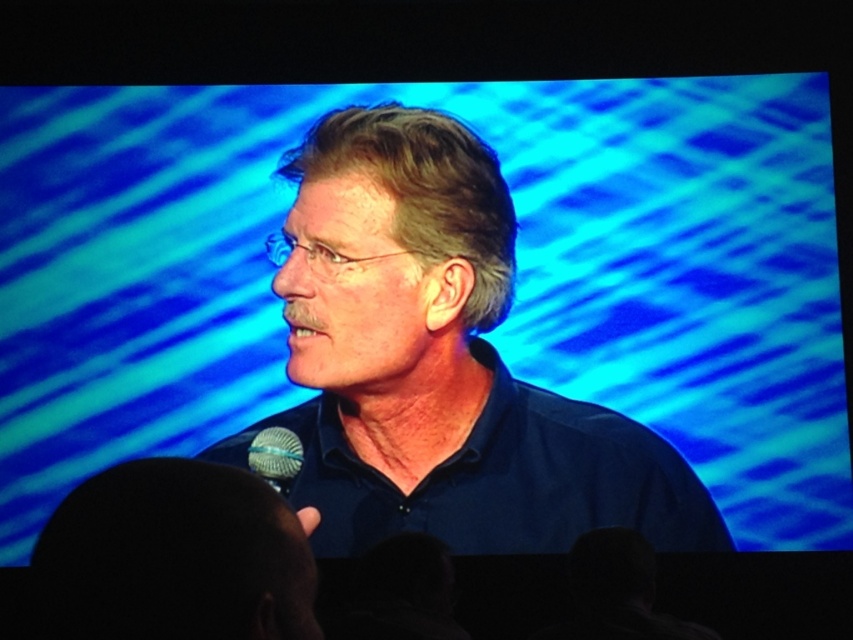
Is blue matte shirt at center smaller than satin silver microphone at lower center?

Actually, blue matte shirt at center might be larger than satin silver microphone at lower center.

Which of these two, blue matte shirt at center or satin silver microphone at lower center, stands shorter?

Standing shorter between the two is satin silver microphone at lower center.

Is point (527, 474) farther from viewer compared to point (282, 449)?

Yes.

The image size is (853, 640). Find the location of `blue matte shirt at center`. blue matte shirt at center is located at coordinates (439, 362).